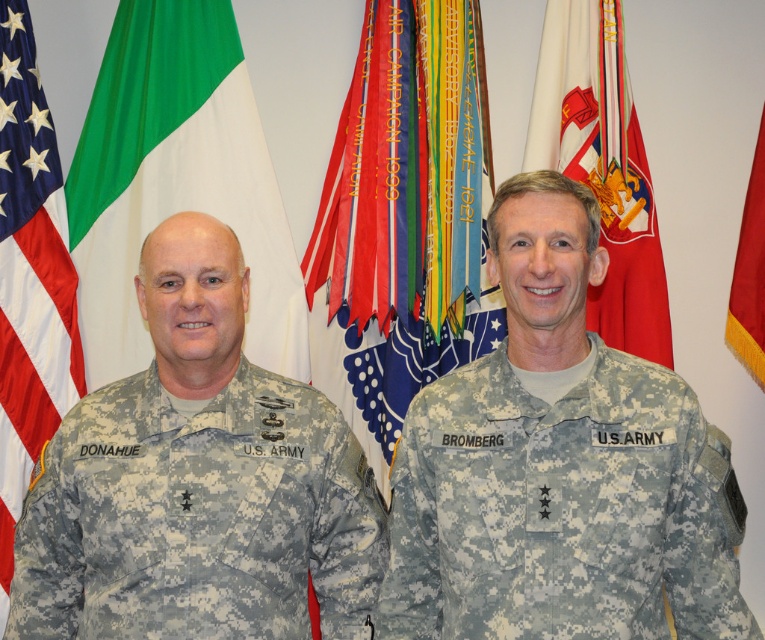
You are a military photographer tasked with capturing a closeup shot of both the multicolored ribbons at center and the red fabric flag at center. Given that your camera has a maximum focus range of 15 inches, will you be able to capture both objects in focus simultaneously?

The multicolored ribbons at center and red fabric flag at center are 15.17 inches apart from each other. Since the distance between them exceeds the camera maximum focus range of 15 inches, you will not be able to capture both objects in focus simultaneously.

You are a military assistant tasked with arranging flags for a ceremony. You have two red fabric flags, one at center and one at right. The American flag must be placed to the left of all other flags. Given the current arrangement, can you determine if the red fabric flag at center is positioned to the left of the red fabric flag at right?

The red fabric flag at center is 14.14 inches away from the red fabric flag at right, which means the red fabric flag at center is positioned to the left of the red fabric flag at right since distance implies relative positioning from left to right.